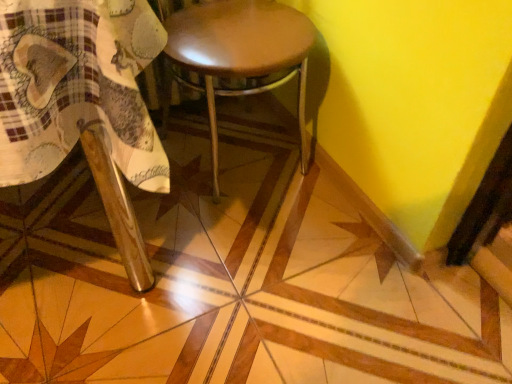
Question: Does shiny brown stool at center appear on the left side of wooden chair at lower left?

Choices:
 (A) no
 (B) yes

Answer: (A)

Question: Is shiny brown stool at center wider than wooden chair at lower left?

Choices:
 (A) yes
 (B) no

Answer: (B)

Question: Is shiny brown stool at center positioned with its back to wooden chair at lower left?

Choices:
 (A) yes
 (B) no

Answer: (B)

Question: Could you tell me if shiny brown stool at center is turned towards wooden chair at lower left?

Choices:
 (A) yes
 (B) no

Answer: (B)

Question: From the image's perspective, is shiny brown stool at center under wooden chair at lower left?

Choices:
 (A) yes
 (B) no

Answer: (B)

Question: Can you confirm if shiny brown stool at center is bigger than wooden chair at lower left?

Choices:
 (A) no
 (B) yes

Answer: (A)

Question: Is wooden chair at lower left not inside shiny brown stool at center?

Choices:
 (A) no
 (B) yes

Answer: (B)

Question: Is wooden chair at lower left directly adjacent to shiny brown stool at center?

Choices:
 (A) no
 (B) yes

Answer: (A)

Question: Can you confirm if wooden chair at lower left is shorter than shiny brown stool at center?

Choices:
 (A) yes
 (B) no

Answer: (B)

Question: Can you confirm if wooden chair at lower left is taller than shiny brown stool at center?

Choices:
 (A) yes
 (B) no

Answer: (A)

Question: Is wooden chair at lower left positioned before shiny brown stool at center?

Choices:
 (A) no
 (B) yes

Answer: (B)

Question: From a real-world perspective, is wooden chair at lower left over shiny brown stool at center?

Choices:
 (A) yes
 (B) no

Answer: (A)

Question: In terms of height, does wooden chair at lower left look taller or shorter compared to shiny brown stool at center?

Choices:
 (A) tall
 (B) short

Answer: (A)